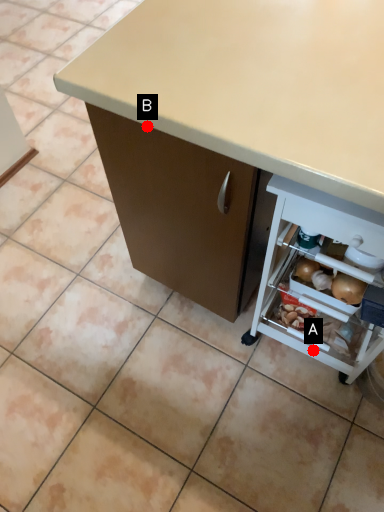
Question: Two points are circled on the image, labeled by A and B beside each circle. Which point is closer to the camera?

Choices:
 (A) A is closer
 (B) B is closer

Answer: (B)